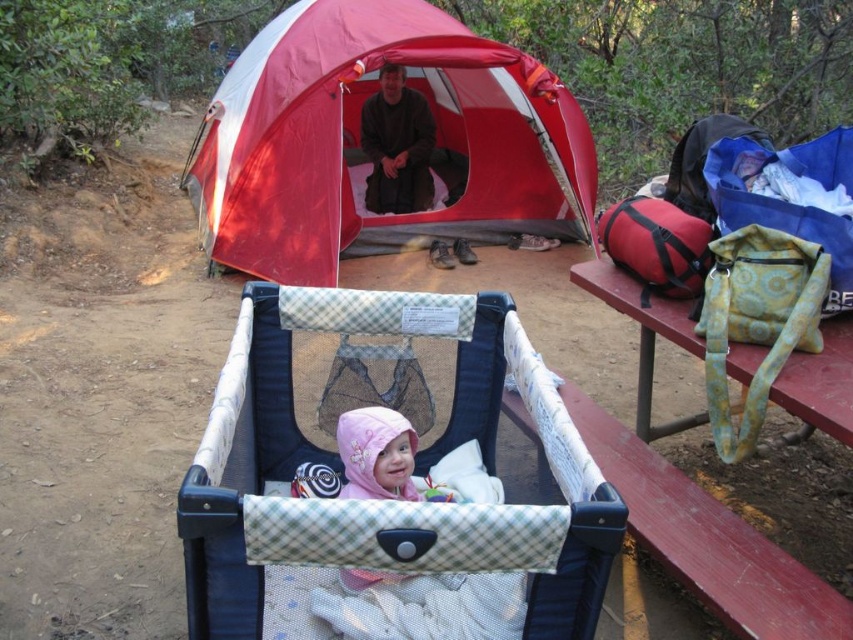
Between red/white fabric tent at upper center and wooden picnic table at right, which one appears on the left side from the viewer's perspective?

Positioned to the left is red/white fabric tent at upper center.

Does red/white fabric tent at upper center have a greater height compared to wooden picnic table at right?

Correct, red/white fabric tent at upper center is much taller as wooden picnic table at right.

Does point (444, 76) come in front of point (676, 308)?

No, it is behind (676, 308).

The width and height of the screenshot is (853, 640). Identify the location of red/white fabric tent at upper center. (358, 147).

From the picture: Is blue fabric playpen at center shorter than red/white fabric tent at upper center?

Yes.

Locate an element on the screen. blue fabric playpen at center is located at coordinates (387, 499).

Describe the element at coordinates (387, 499) in the screenshot. I see `blue fabric playpen at center` at that location.

Image resolution: width=853 pixels, height=640 pixels. What do you see at coordinates (387, 499) in the screenshot?
I see `blue fabric playpen at center` at bounding box center [387, 499].

What are the coordinates of `blue fabric playpen at center` in the screenshot? It's located at (387, 499).